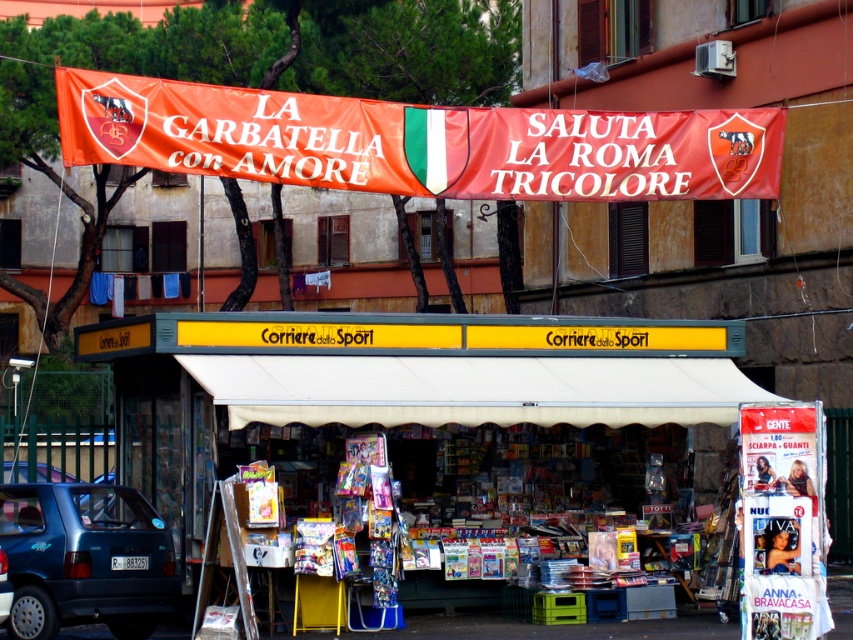
You are a delivery person needing to park your 2.5 meter wide van between the yellow corrugated metal kiosk at center and the metallic blue car at lower left. Is there enough space for your van to fit between them?

The yellow corrugated metal kiosk at center is 5.57 meters away from the metallic blue car at lower left. Since your van is 2.5 meters wide, there is sufficient space between them for the van to fit.

You are a pedestrian standing on the street looking at the yellow corrugated metal kiosk at center and the orange fabric banner at upper center. Which object is closer to you?

The yellow corrugated metal kiosk at center is closer to you because the orange fabric banner at upper center is behind it.